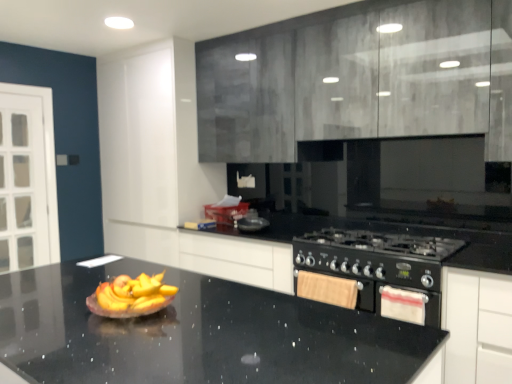
Question: Is matte gray cabinets at upper center thinner than black matte gas stove at lower right?

Choices:
 (A) yes
 (B) no

Answer: (A)

Question: From the image's perspective, is matte gray cabinets at upper center located beneath black matte gas stove at lower right?

Choices:
 (A) yes
 (B) no

Answer: (B)

Question: Considering the relative positions of matte gray cabinets at upper center and black matte gas stove at lower right in the image provided, is matte gray cabinets at upper center behind black matte gas stove at lower right?

Choices:
 (A) no
 (B) yes

Answer: (A)

Question: Is black matte gas stove at lower right surrounded by matte gray cabinets at upper center?

Choices:
 (A) yes
 (B) no

Answer: (B)

Question: Is matte gray cabinets at upper center smaller than black matte gas stove at lower right?

Choices:
 (A) no
 (B) yes

Answer: (A)

Question: In terms of width, does black matte gas stove at lower right look wider or thinner when compared to white fabric oven at lower right?

Choices:
 (A) wide
 (B) thin

Answer: (A)

Question: From the image's perspective, is black matte gas stove at lower right located above or below white fabric oven at lower right?

Choices:
 (A) above
 (B) below

Answer: (A)

Question: From a real-world perspective, is black matte gas stove at lower right positioned above or below white fabric oven at lower right?

Choices:
 (A) above
 (B) below

Answer: (A)

Question: Relative to white fabric oven at lower right, is black matte gas stove at lower right in front or behind?

Choices:
 (A) behind
 (B) front

Answer: (B)

Question: Looking at the image, does white fabric oven at lower right seem bigger or smaller compared to black granite countertop at center?

Choices:
 (A) small
 (B) big

Answer: (A)

Question: Considering their positions, is white fabric oven at lower right located in front of or behind black granite countertop at center?

Choices:
 (A) front
 (B) behind

Answer: (B)

Question: From the image's perspective, relative to black granite countertop at center, is white fabric oven at lower right above or below?

Choices:
 (A) above
 (B) below

Answer: (A)

Question: From a real-world perspective, relative to black granite countertop at center, is white fabric oven at lower right vertically above or below?

Choices:
 (A) above
 (B) below

Answer: (A)

Question: Based on their positions, is white fabric oven at lower right located to the left or right of black matte gas stove at lower right?

Choices:
 (A) right
 (B) left

Answer: (A)

Question: In terms of width, does white fabric oven at lower right look wider or thinner when compared to black matte gas stove at lower right?

Choices:
 (A) thin
 (B) wide

Answer: (A)